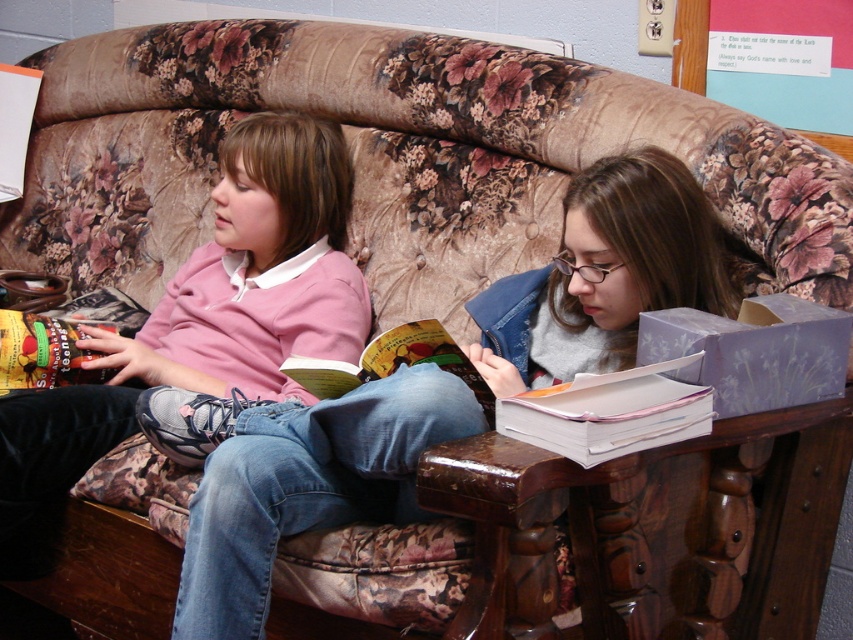
Question: Does pink cotton shirt at left lie behind hardcover book at center?

Choices:
 (A) yes
 (B) no

Answer: (A)

Question: Which point is farther to the camera?

Choices:
 (A) (251, 269)
 (B) (552, 413)

Answer: (A)

Question: Which of the following is the closest to the observer?

Choices:
 (A) pink cotton shirt at left
 (B) hardcover book at center
 (C) white paper book at lower right

Answer: (C)

Question: Which point is farther to the camera?

Choices:
 (A) (440, 332)
 (B) (709, 416)

Answer: (A)

Question: Can you confirm if pink cotton shirt at left is thinner than white paper book at lower right?

Choices:
 (A) yes
 (B) no

Answer: (B)

Question: Is pink cotton shirt at left positioned in front of white paper book at lower right?

Choices:
 (A) yes
 (B) no

Answer: (B)